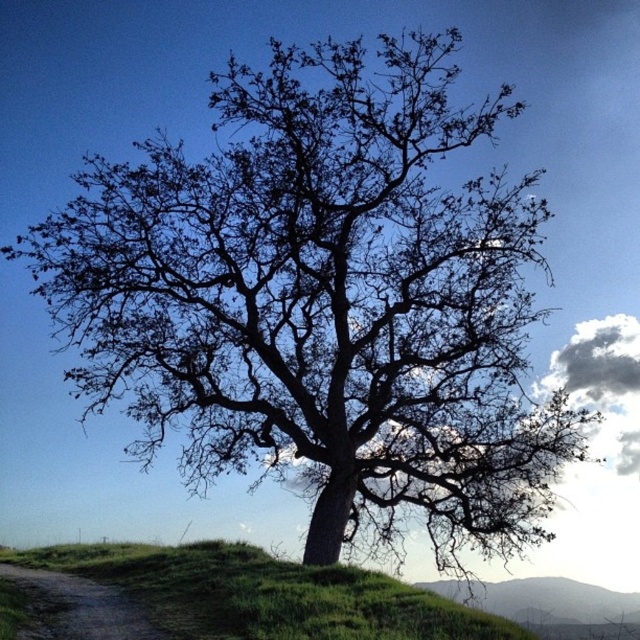
Between green grassy hill at lower center and green grassy hillside at lower right, which one is positioned lower?

green grassy hillside at lower right

Is green grassy hill at lower center below green grassy hillside at lower right?

Incorrect, green grassy hill at lower center is not positioned below green grassy hillside at lower right.

Is point (147, 596) positioned before point (620, 621)?

Yes.

You are a GUI agent. You are given a task and a screenshot of the screen. Output one action in this format:
    pyautogui.click(x=<x>, y=<y>)
    Task: Click on the green grassy hill at lower center
    
    Given the screenshot: What is the action you would take?
    pyautogui.click(x=268, y=595)

Can you confirm if green grassy hill at lower center is bigger than dirt/gravel path at lower left?

No.

Does green grassy hill at lower center lie in front of dirt/gravel path at lower left?

No, it is behind dirt/gravel path at lower left.

Between point (342, 605) and point (88, 611), which one is positioned in front?

Positioned in front is point (342, 605).

Image resolution: width=640 pixels, height=640 pixels. Identify the location of green grassy hill at lower center. (268, 595).

Is green grassy hillside at lower right above dirt/gravel path at lower left?

No.

Which is below, green grassy hillside at lower right or dirt/gravel path at lower left?

green grassy hillside at lower right is below.

Is point (536, 612) closer to camera compared to point (132, 634)?

No, it is not.

Where is `green grassy hillside at lower right`? The image size is (640, 640). green grassy hillside at lower right is located at coordinates (541, 600).